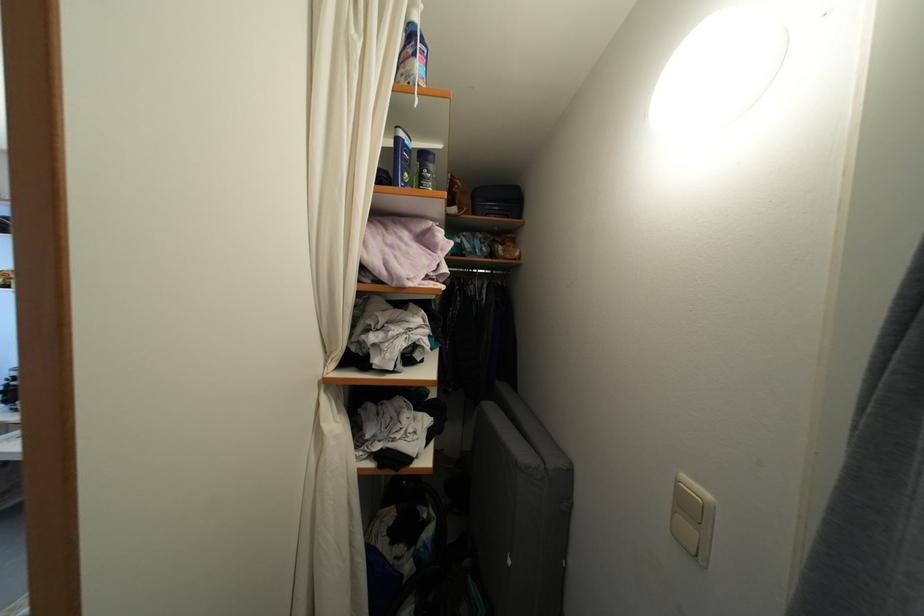
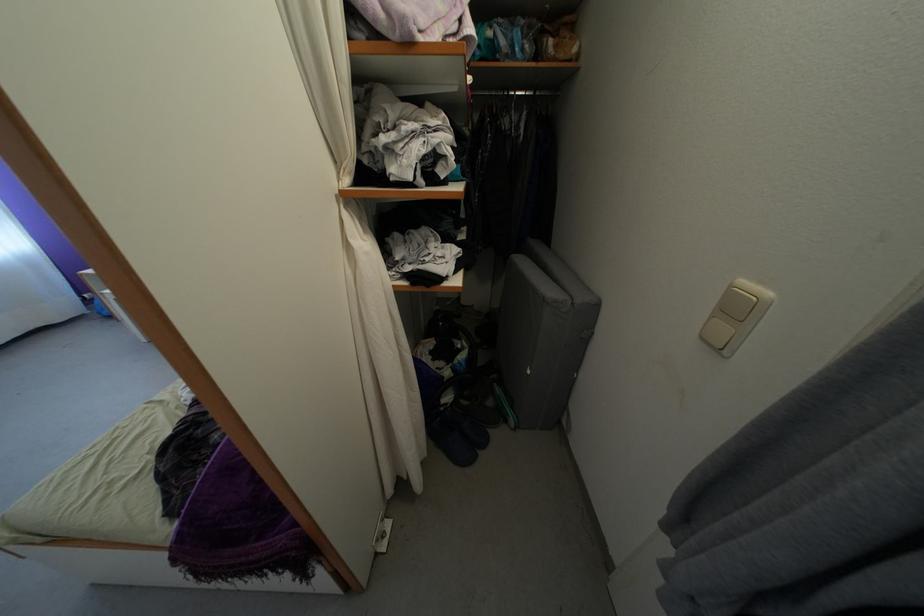
Find the pixel in the second image that matches pixel 679 517 in the first image.

(718, 323)